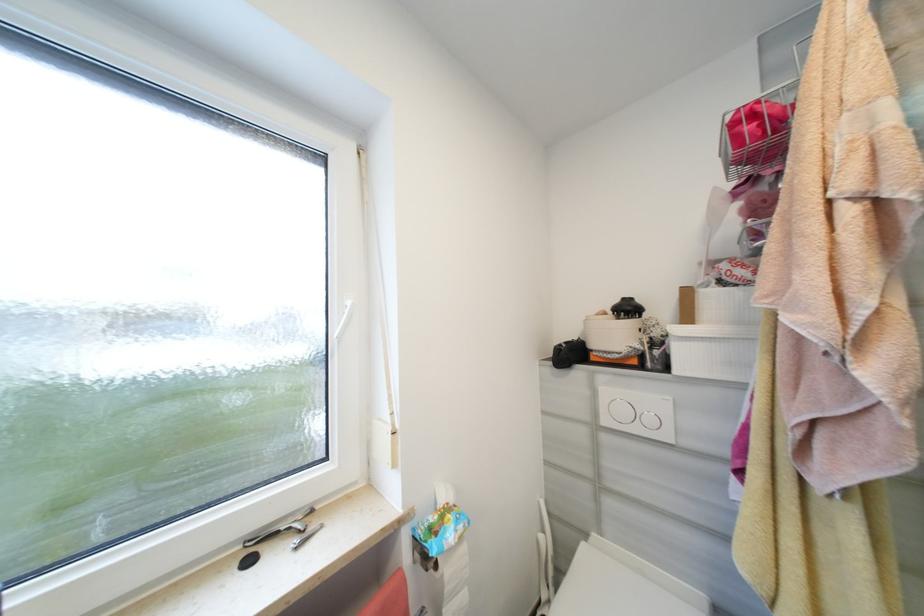
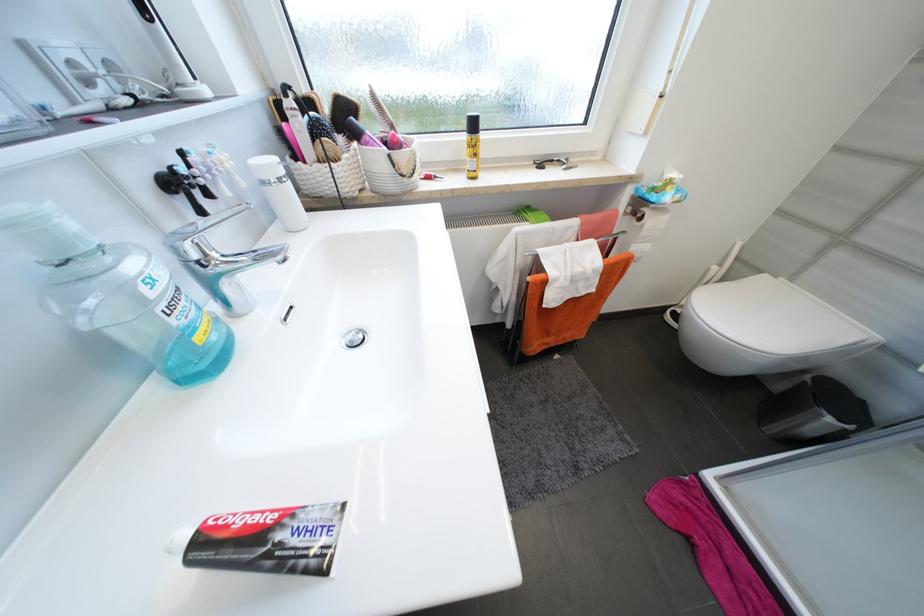
The point at [442,567] is marked in the first image. Where is the corresponding point in the second image?

(647, 219)